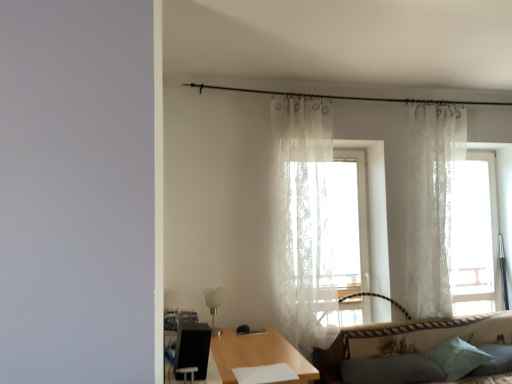
Question: Is soft blue pillow at lower right, which is the 1th pillow from right to left, further to camera compared to black textured swivel chair at lower left?

Choices:
 (A) no
 (B) yes

Answer: (B)

Question: Is soft blue pillow at lower right, which is the 1th pillow from right to left, outside black textured swivel chair at lower left?

Choices:
 (A) no
 (B) yes

Answer: (B)

Question: Is soft blue pillow at lower right, which is the 1th pillow from right to left, positioned with its back to black textured swivel chair at lower left?

Choices:
 (A) no
 (B) yes

Answer: (A)

Question: From the image's perspective, is soft blue pillow at lower right, acting as the third pillow starting from the left, over black textured swivel chair at lower left?

Choices:
 (A) no
 (B) yes

Answer: (A)

Question: Does soft blue pillow at lower right, acting as the third pillow starting from the left, have a larger size compared to black textured swivel chair at lower left?

Choices:
 (A) yes
 (B) no

Answer: (A)

Question: Can you see soft blue pillow at lower right, acting as the third pillow starting from the left, touching black textured swivel chair at lower left?

Choices:
 (A) yes
 (B) no

Answer: (B)

Question: Could you tell me if black textured swivel chair at lower left is turned towards wooden table at center?

Choices:
 (A) yes
 (B) no

Answer: (B)

Question: Is black textured swivel chair at lower left bigger than wooden table at center?

Choices:
 (A) no
 (B) yes

Answer: (A)

Question: Considering the relative positions of black textured swivel chair at lower left and wooden table at center in the image provided, is black textured swivel chair at lower left to the left of wooden table at center from the viewer's perspective?

Choices:
 (A) yes
 (B) no

Answer: (A)

Question: Is wooden table at center surrounded by black textured swivel chair at lower left?

Choices:
 (A) yes
 (B) no

Answer: (B)

Question: Is black textured swivel chair at lower left not within wooden table at center?

Choices:
 (A) yes
 (B) no

Answer: (A)

Question: Does black textured swivel chair at lower left have a greater width compared to wooden table at center?

Choices:
 (A) no
 (B) yes

Answer: (A)

Question: From a real-world perspective, is white glass lamp at lower center beneath transparent lace curtain at right?

Choices:
 (A) no
 (B) yes

Answer: (B)